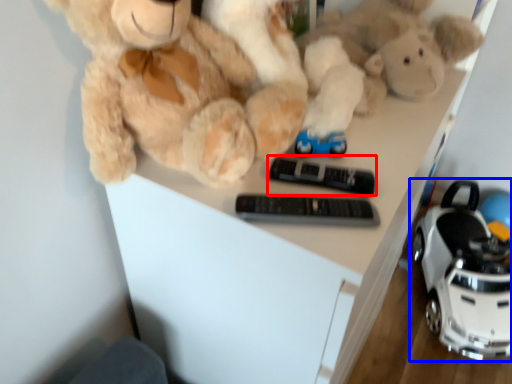
Question: Which point is further to the camera, control (highlighted by a red box) or land vehicle (highlighted by a blue box)?

Choices:
 (A) control
 (B) land vehicle

Answer: (B)